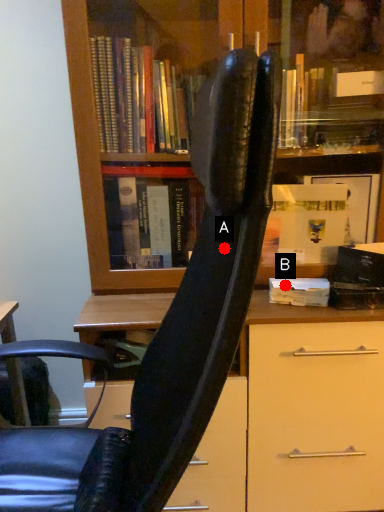
Question: Two points are circled on the image, labeled by A and B beside each circle. Which point appears closest to the camera in this image?

Choices:
 (A) A is closer
 (B) B is closer

Answer: (A)